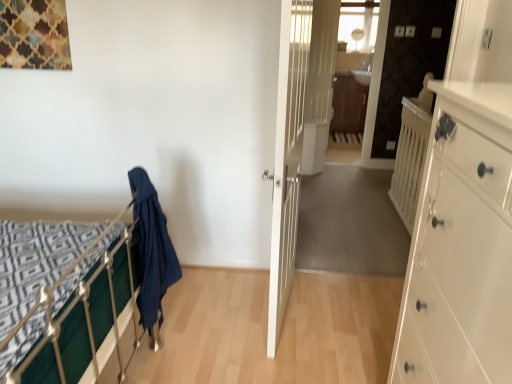
Locate an element on the screen. This screenshot has width=512, height=384. free space in front of white wooden door at center, the 2th door viewed from the right is located at coordinates (290, 352).